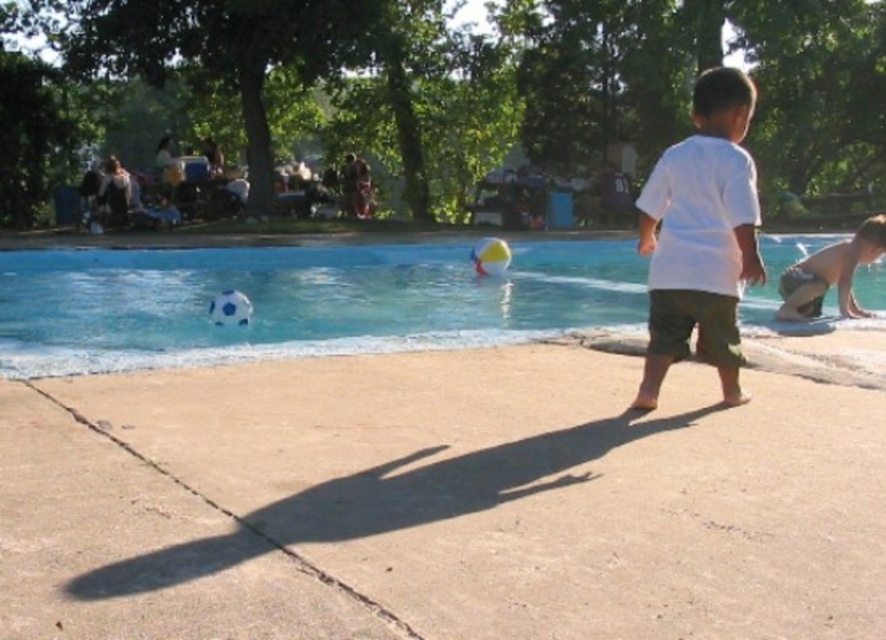
You are a photographer trying to capture a photo of the blue rubber ball at lower center and the white cotton shirt at center. To ensure both are in the frame, should you pan your camera to the left or right?

Since the blue rubber ball at lower center is to the right of the white cotton shirt at center, you should pan your camera to the right to include both objects in the frame.

You are a photographer trying to capture a photo of the white cotton shirt at center and the tan skin boy at right. Based on their heights, which one would you need to adjust your camera angle upwards to focus on?

The white cotton shirt at center has a greater height compared to the tan skin boy at right, so you would need to adjust your camera angle upwards to focus on the white cotton shirt at center.